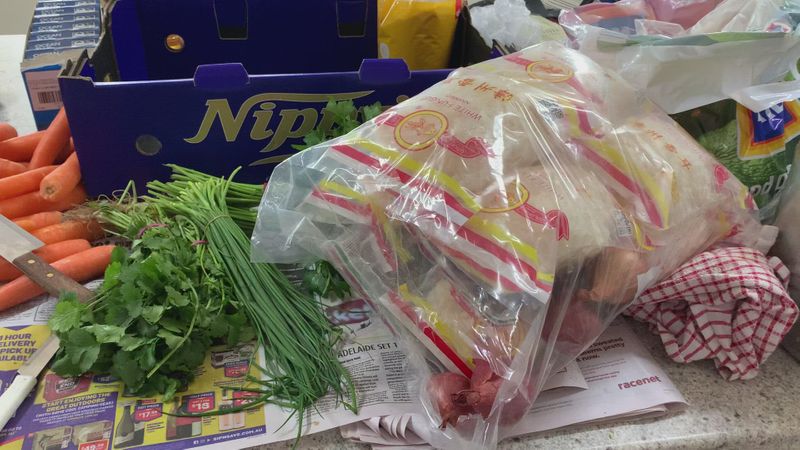
Where is `magazine`? magazine is located at coordinates [625, 399], [644, 364].